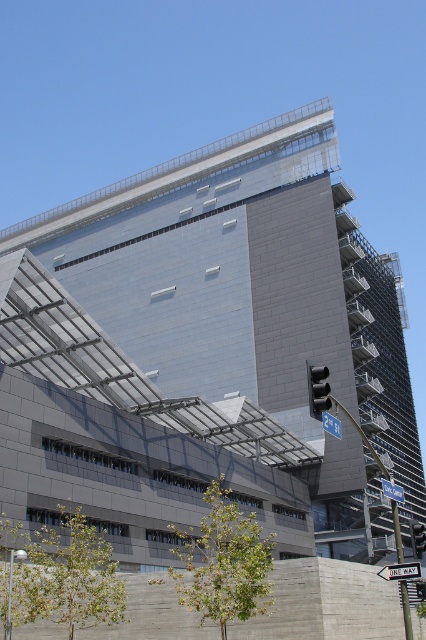
Does black glass traffic light at center have a greater height compared to blue metallic street sign at upper center?

Correct, black glass traffic light at center is much taller as blue metallic street sign at upper center.

Between black glass traffic light at center and blue metallic street sign at upper center, which one is positioned higher?

blue metallic street sign at upper center is higher up.

Does point (417, 534) come behind point (385, 483)?

Yes, point (417, 534) is farther from viewer.

The width and height of the screenshot is (426, 640). Find the location of `black glass traffic light at center`. black glass traffic light at center is located at coordinates (417, 538).

Can you confirm if black plastic traffic light at center is positioned above white plastic street sign at lower right?

Yes, black plastic traffic light at center is above white plastic street sign at lower right.

Which is in front, point (313, 385) or point (382, 568)?

Point (313, 385) is more forward.

Identify the location of black plastic traffic light at center. (317, 390).

Does point (328, 390) lie behind point (397, 499)?

No, it is not.

Does black plastic traffic light at center have a larger size compared to blue metallic street sign at upper center?

No.

Describe the element at coordinates (317, 390) in the screenshot. I see `black plastic traffic light at center` at that location.

In order to click on black plastic traffic light at center in this screenshot , I will do `click(317, 390)`.